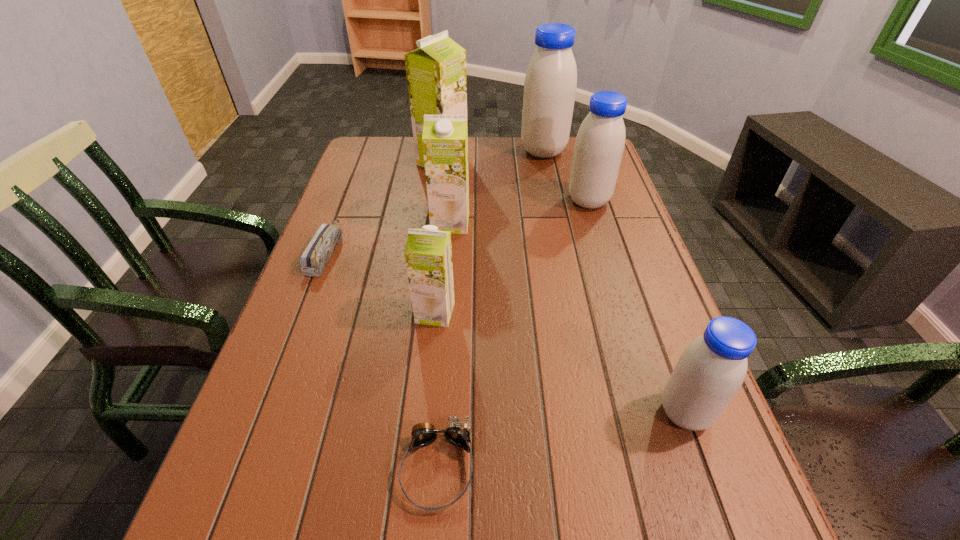
Where is `object identified as the seventh closest to the leftmost object`? The height and width of the screenshot is (540, 960). object identified as the seventh closest to the leftmost object is located at coordinates (712, 368).

This screenshot has height=540, width=960. In order to click on the fifth closest object to the farthest green soya milk in this screenshot , I will do `click(428, 254)`.

Locate which soya milk ranks second in proximity to the second nearest blue soya milk. Please provide its 2D coordinates. Your answer should be formatted as a tuple, i.e. [(x, y)], where the tuple contains the x and y coordinates of a point satisfying the conditions above.

[(445, 137)]

Select which soya milk appears as the fifth closest to the second biggest blue soya milk. Please provide its 2D coordinates. Your answer should be formatted as a tuple, i.e. [(x, y)], where the tuple contains the x and y coordinates of a point satisfying the conditions above.

[(712, 368)]

Choose which blue soya milk is the third nearest neighbor to the biggest green soya milk. Please provide its 2D coordinates. Your answer should be formatted as a tuple, i.e. [(x, y)], where the tuple contains the x and y coordinates of a point satisfying the conditions above.

[(712, 368)]

Image resolution: width=960 pixels, height=540 pixels. I want to click on the third closest blue soya milk to the farthest green soya milk, so click(x=712, y=368).

Point out which green soya milk is positioned as the second nearest to the pencil box. Please provide its 2D coordinates. Your answer should be formatted as a tuple, i.e. [(x, y)], where the tuple contains the x and y coordinates of a point satisfying the conditions above.

[(445, 137)]

Locate which green soya milk is the second closest to the smallest blue soya milk. Please provide its 2D coordinates. Your answer should be formatted as a tuple, i.e. [(x, y)], where the tuple contains the x and y coordinates of a point satisfying the conditions above.

[(445, 137)]

You are a GUI agent. You are given a task and a screenshot of the screen. Output one action in this format:
    pyautogui.click(x=<x>, y=<y>)
    Task: Click on the free space in the image that satisfies the following two spatial constraints: 1. on the back side of the farthest blue soya milk; 2. on the right side of the leftmost object
    The height and width of the screenshot is (540, 960).
    Given the screenshot: What is the action you would take?
    pyautogui.click(x=365, y=151)

The image size is (960, 540). What are the coordinates of `free spot that satisfies the following two spatial constraints: 1. on the front side of the smallest green soya milk; 2. on the right side of the nearest soya milk` in the screenshot? It's located at (425, 413).